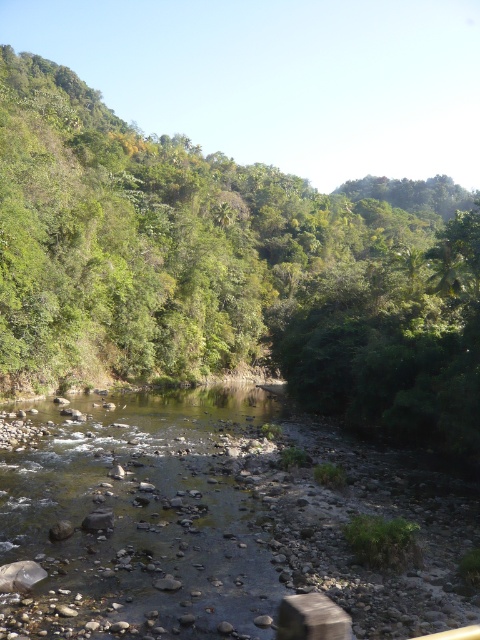
You are standing at the origin point of the coordinate system in the image. You want to walk to the green leafy tree at center. Which direction should you move in to reach it?

The green leafy tree at center is located at coordinate point (230, 266), so you should move towards the center of the image to reach it.